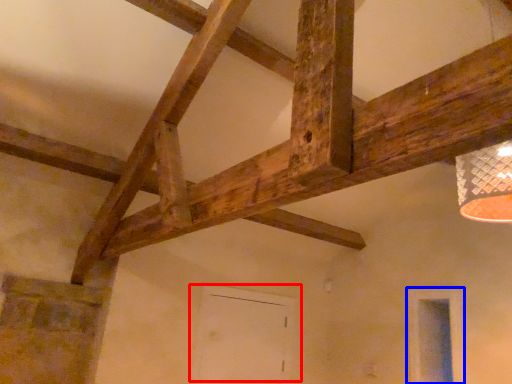
Question: Which point is further to the camera, door (highlighted by a red box) or window (highlighted by a blue box)?

Choices:
 (A) door
 (B) window

Answer: (A)